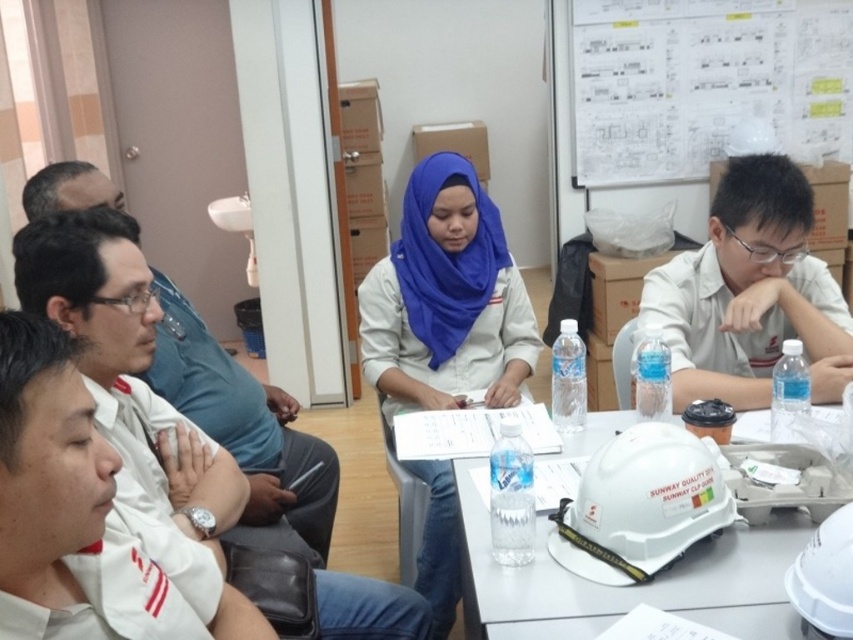
Locate an element on the screen. The image size is (853, 640). matte blue hijab at center is located at coordinates (445, 298).

Image resolution: width=853 pixels, height=640 pixels. Describe the element at coordinates (445, 298) in the screenshot. I see `matte blue hijab at center` at that location.

This screenshot has height=640, width=853. What are the coordinates of `matte blue hijab at center` in the screenshot? It's located at click(x=445, y=298).

Find the location of a particular element. Image resolution: width=853 pixels, height=640 pixels. matte blue hijab at center is located at coordinates (445, 298).